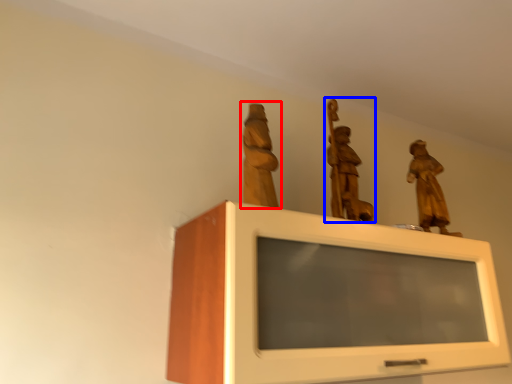
Question: Which object is further to the camera taking this photo, sculpture (highlighted by a red box) or sculpture (highlighted by a blue box)?

Choices:
 (A) sculpture
 (B) sculpture

Answer: (B)